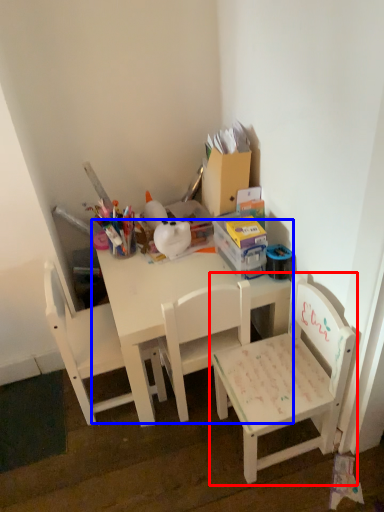
Question: Which object appears closest to the camera in this image, chair (highlighted by a red box) or table (highlighted by a blue box)?

Choices:
 (A) chair
 (B) table

Answer: (A)